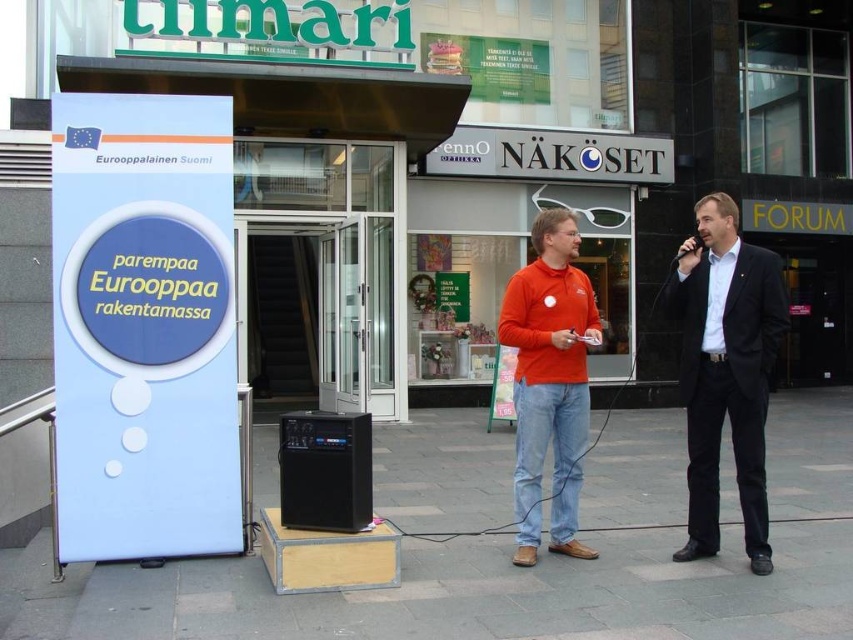
Question: Does dark blue suit at right appear on the right side of black plastic speaker at center?

Choices:
 (A) yes
 (B) no

Answer: (A)

Question: Which object is the farthest from the orange cotton shirt at center?

Choices:
 (A) dark blue suit at right
 (B) black plastic speaker at center

Answer: (B)

Question: Is orange cotton shirt at center positioned before black plastic speaker at center?

Choices:
 (A) no
 (B) yes

Answer: (A)

Question: Estimate the real-world distances between objects in this image. Which object is closer to the black plastic speaker at center?

Choices:
 (A) orange cotton shirt at center
 (B) dark blue suit at right

Answer: (A)

Question: Which of the following is the closest to the observer?

Choices:
 (A) black plastic speaker at center
 (B) orange cotton shirt at center
 (C) dark blue suit at right

Answer: (A)

Question: Is dark blue suit at right bigger than orange cotton shirt at center?

Choices:
 (A) yes
 (B) no

Answer: (A)